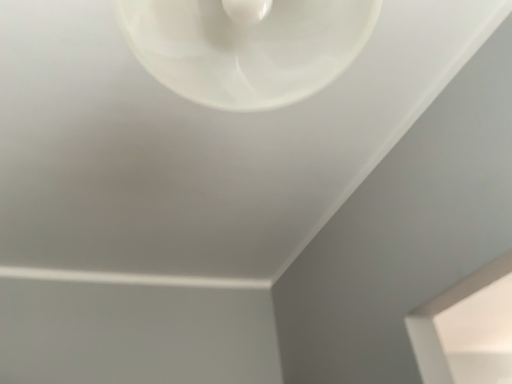
Question: Should I look upward or downward to see white glossy toilet at upper center?

Choices:
 (A) down
 (B) up

Answer: (B)